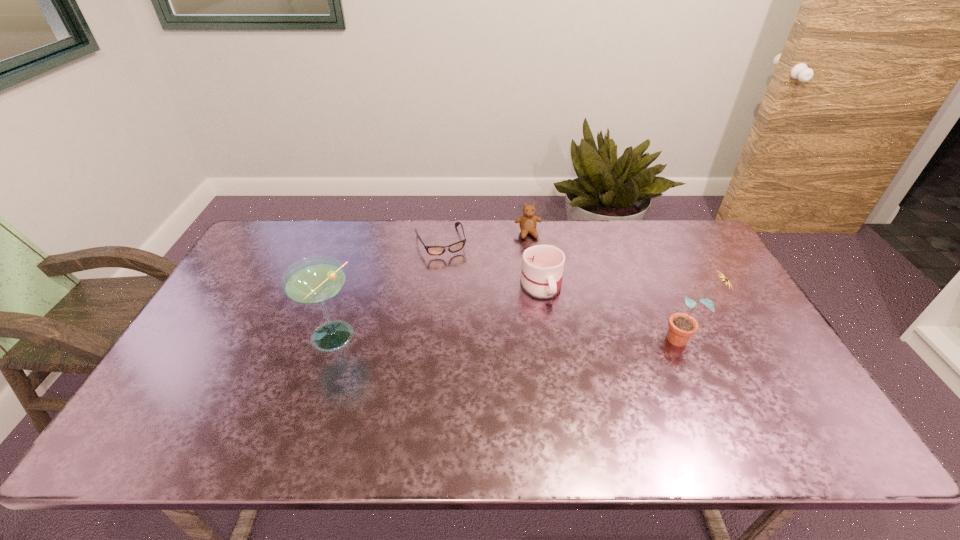
Locate an element on the screen. This screenshot has width=960, height=540. blank area located 0.220m on the side with the handle of the mug is located at coordinates (566, 364).

This screenshot has width=960, height=540. What are the coordinates of `vacant space situated on the side with the handle of the mug` in the screenshot? It's located at (569, 370).

Locate an element on the screen. This screenshot has height=540, width=960. vacant space located on the side with the handle of the mug is located at coordinates pyautogui.click(x=574, y=387).

This screenshot has width=960, height=540. What are the coordinates of `free space located on the front-facing side of the teddy bear` in the screenshot? It's located at (548, 306).

Identify the location of free space located 0.260m on the front-facing side of the teddy bear. (543, 290).

Locate an element on the screen. free space located 0.050m on the front-facing side of the teddy bear is located at coordinates (532, 249).

Locate an element on the screen. free space located 0.070m on the front-facing side of the spectacles is located at coordinates (452, 271).

Where is `vacant space situated 0.300m on the front-facing side of the spectacles`? This screenshot has height=540, width=960. vacant space situated 0.300m on the front-facing side of the spectacles is located at coordinates (471, 320).

I want to click on blank space located 0.070m on the front-facing side of the spectacles, so click(x=452, y=271).

What are the coordinates of `teddy bear at the far edge` in the screenshot? It's located at (528, 222).